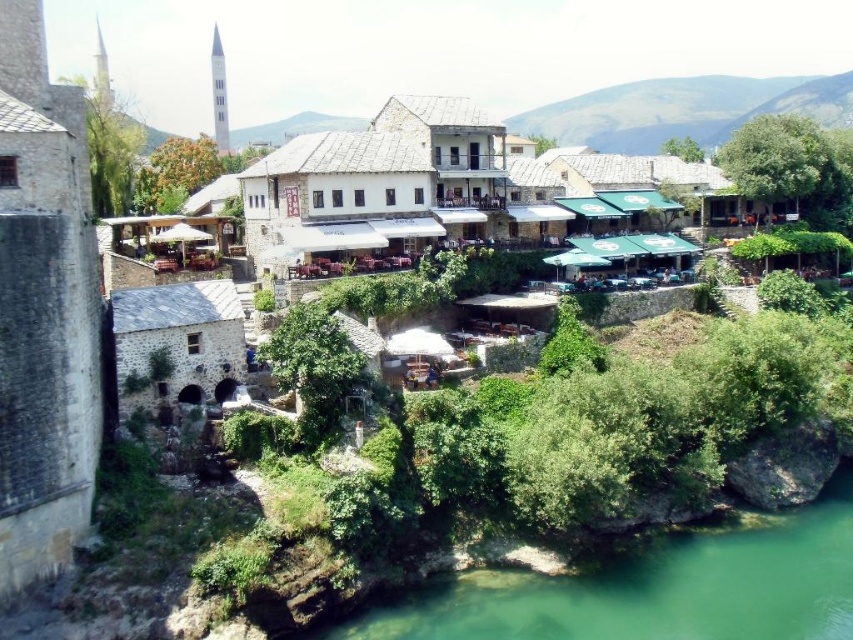
Question: Is green stone river at lower center positioned behind stone/brick building at center?

Choices:
 (A) no
 (B) yes

Answer: (A)

Question: Among these objects, which one is nearest to the camera?

Choices:
 (A) green stone river at lower center
 (B) stone/brick building at center

Answer: (A)

Question: Which object appears closest to the camera in this image?

Choices:
 (A) stone/brick building at center
 (B) green stone river at lower center

Answer: (B)

Question: Can you confirm if green stone river at lower center is positioned to the left of stone/brick building at center?

Choices:
 (A) yes
 (B) no

Answer: (B)

Question: Does green stone river at lower center have a smaller size compared to stone/brick building at center?

Choices:
 (A) yes
 (B) no

Answer: (A)